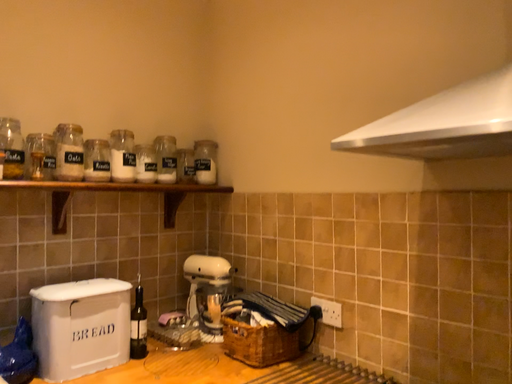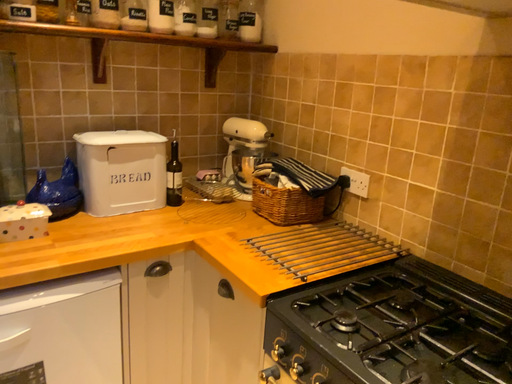
Question: Which way did the camera rotate in the video?

Choices:
 (A) rotated left
 (B) rotated right

Answer: (A)